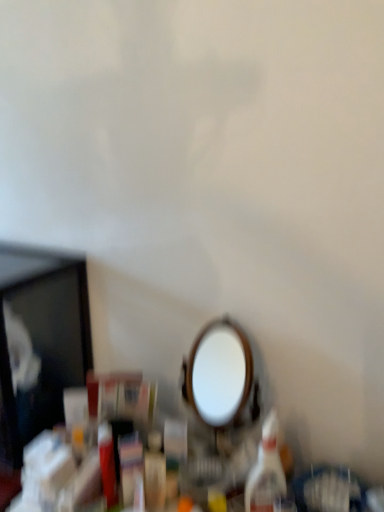
Describe the element at coordinates (266, 470) in the screenshot. I see `translucent plastic spray bottle at lower right` at that location.

At what (x,y) coordinates should I click in order to perform the action: click on translucent plastic spray bottle at lower right. Please return your answer as a coordinate pair (x, y). Looking at the image, I should click on (266, 470).

What is the approximate width of translucent plastic spray bottle at lower right?

2.99 inches.

The height and width of the screenshot is (512, 384). Find the location of `translucent plastic spray bottle at lower right`. translucent plastic spray bottle at lower right is located at coordinates (266, 470).